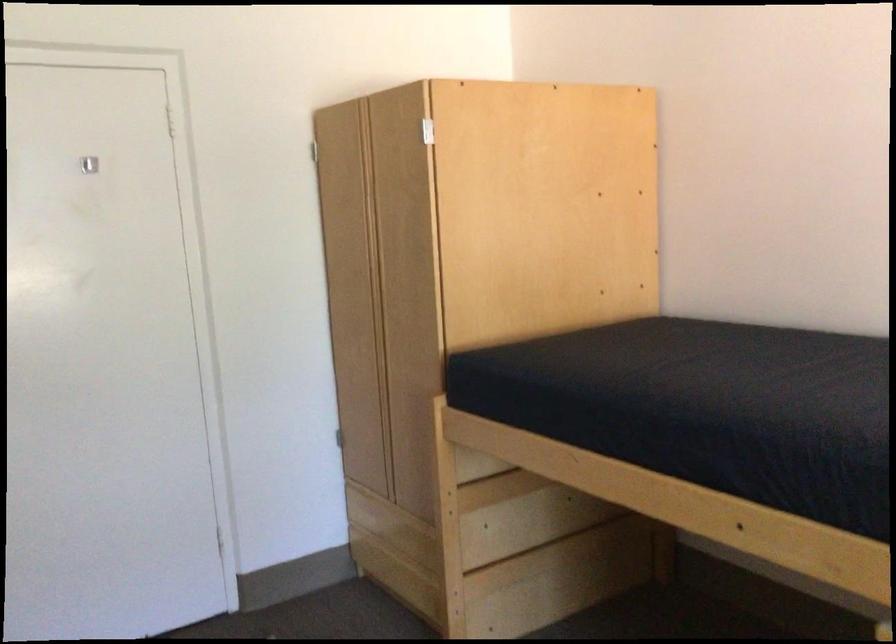
First-person continuous shooting, in which direction is the camera rotating?

The camera rotated toward right-down.